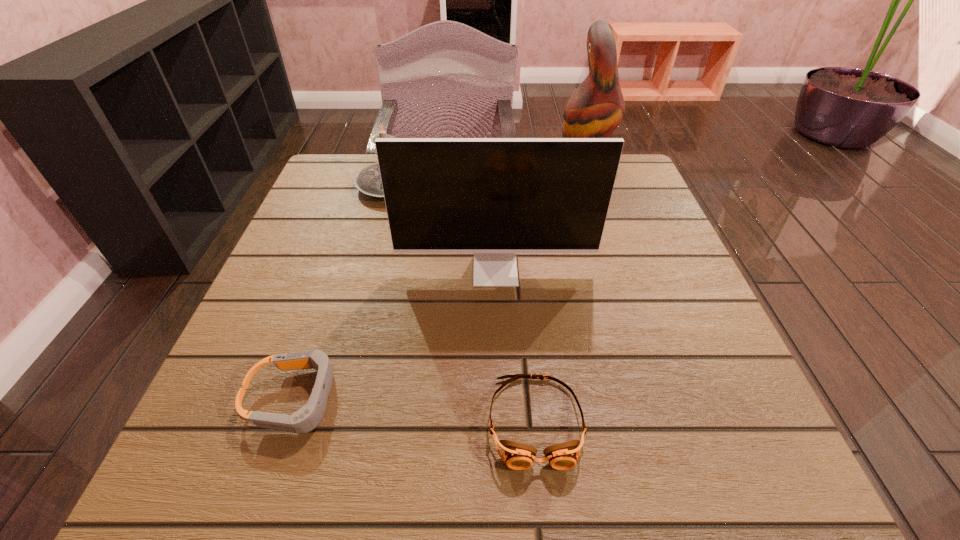
You are a GUI agent. You are given a task and a screenshot of the screen. Output one action in this format:
    pyautogui.click(x=<x>, y=<y>)
    Task: Click on the free space between the parrot and the right goggles
    This screenshot has width=960, height=540.
    Given the screenshot: What is the action you would take?
    pyautogui.click(x=561, y=295)

Identify the location of unoccupied area between the parrot and the left goggles. The image size is (960, 540). (441, 284).

Where is `free point between the tallest object and the right goggles`? This screenshot has width=960, height=540. free point between the tallest object and the right goggles is located at coordinates (561, 295).

This screenshot has height=540, width=960. Identify the location of the fourth closest object to the left goggles. (595, 109).

Choose which object is the second nearest neighbor to the candle. Please provide its 2D coordinates. Your answer should be formatted as a tuple, i.e. [(x, y)], where the tuple contains the x and y coordinates of a point satisfying the conditions above.

[(595, 109)]

Where is `vacant area that satisfies the following two spatial constraints: 1. on the face of the parrot; 2. on the front-facing side of the monitor`? vacant area that satisfies the following two spatial constraints: 1. on the face of the parrot; 2. on the front-facing side of the monitor is located at coordinates (620, 271).

Find the location of a particular element. The height and width of the screenshot is (540, 960). free space that satisfies the following two spatial constraints: 1. on the face of the parrot; 2. with the lenses facing forward on the right goggles is located at coordinates (671, 421).

You are a GUI agent. You are given a task and a screenshot of the screen. Output one action in this format:
    pyautogui.click(x=<x>, y=<y>)
    Task: Click on the free space that satisfies the following two spatial constraints: 1. on the front-facing side of the third farthest object; 2. on the front and back of the left goggles
    Image resolution: width=960 pixels, height=540 pixels.
    Given the screenshot: What is the action you would take?
    pyautogui.click(x=500, y=399)

Identify the location of free spot that satisfies the following two spatial constraints: 1. on the face of the tallest object; 2. on the front-facing side of the fourth shortest object. (620, 271).

The image size is (960, 540). In order to click on vacant region that satisfies the following two spatial constraints: 1. on the face of the tallest object; 2. on the front-facing side of the third farthest object in this screenshot , I will do `click(620, 271)`.